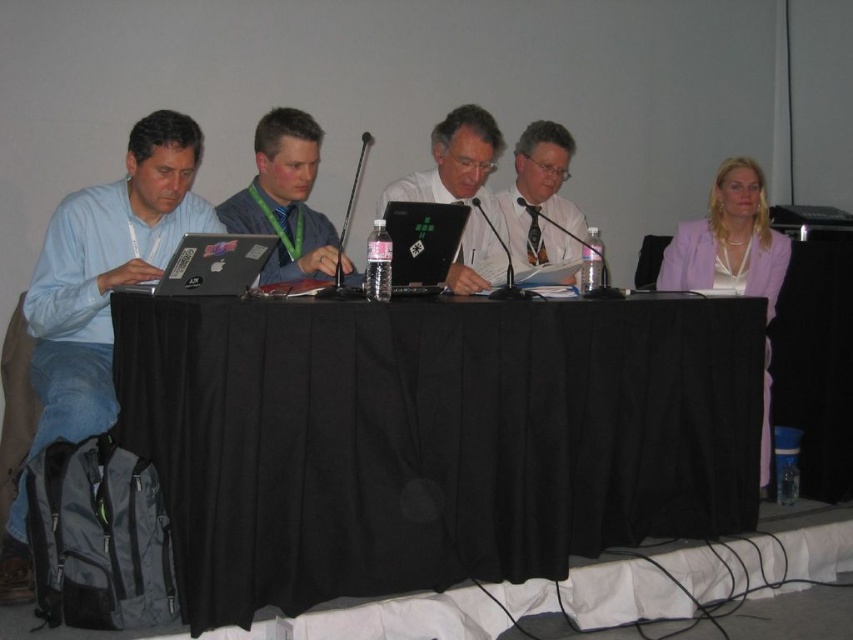
You are sitting in the audience and want to hand a note to the person wearing the matte blue shirt at left without disturbing the matte black laptop at left. Which object is closer to you, allowing you to reach the shirt wearer first?

The matte blue shirt at left is closer to you than the matte black laptop at left, so you can reach the person wearing the matte blue shirt at left first without disturbing the laptop.

You are a photographer setting up for a group photo at the panel discussion. You need to position your camera so that both the black fabric table at center and the matte black laptop at center are in frame. Given their height difference, which object will appear larger in the photo?

The black fabric table at center is much taller than the matte black laptop at center, so it will appear larger in the photo due to its greater height.

You are organizing a conference and need to ensure that the matte black laptop at center is visible to the audience. Since the black fabric table at center is in front of it, will the laptop still be visible?

The black fabric table at center is positioned under the matte black laptop at center, so the laptop is placed above the table. This means the laptop should still be visible to the audience as it is elevated above the table surface.